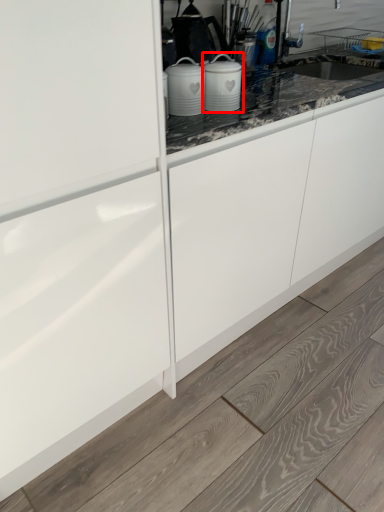
Question: From the image's perspective, where is kitchen appliance (annotated by the red box) located relative to home appliance?

Choices:
 (A) above
 (B) below

Answer: (A)